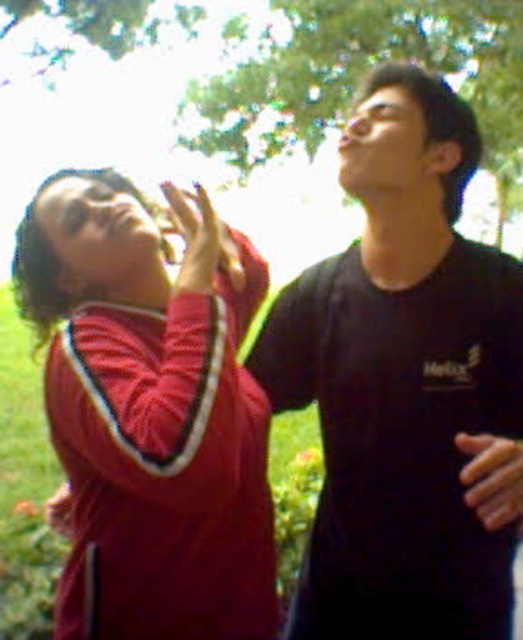
Is black matte shirt at center below matte red jacket at left?

No.

Can you confirm if black matte shirt at center is positioned to the right of matte red jacket at left?

Indeed, black matte shirt at center is positioned on the right side of matte red jacket at left.

Find the location of a particular element. black matte shirt at center is located at coordinates pos(402,380).

Can you confirm if black matte shirt at center is positioned to the left of matte red hand at upper left?

No, black matte shirt at center is not to the left of matte red hand at upper left.

Between black matte shirt at center and matte red hand at upper left, which one has less height?

matte red hand at upper left is shorter.

Is point (305, 369) closer to viewer compared to point (198, 212)?

No, it is behind (198, 212).

Find the location of a particular element. Image resolution: width=523 pixels, height=640 pixels. black matte shirt at center is located at coordinates (402, 380).

Who is more distant from viewer, (235, 285) or (503, 440)?

The point (235, 285) is more distant.

Between matte red hand at upper left and smooth skin hand at lower right, which one is positioned higher?

matte red hand at upper left

Find the location of `matte red hand at upper left`. matte red hand at upper left is located at coordinates (201, 241).

You are a GUI agent. You are given a task and a screenshot of the screen. Output one action in this format:
    pyautogui.click(x=<x>, y=<y>)
    Task: Click on the matte red hand at upper left
    
    Given the screenshot: What is the action you would take?
    pyautogui.click(x=201, y=241)